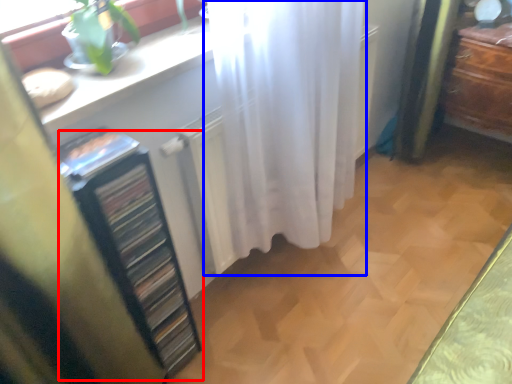
Question: Which object is further to the camera taking this photo, file cabinet (highlighted by a red box) or curtain (highlighted by a blue box)?

Choices:
 (A) file cabinet
 (B) curtain

Answer: (B)